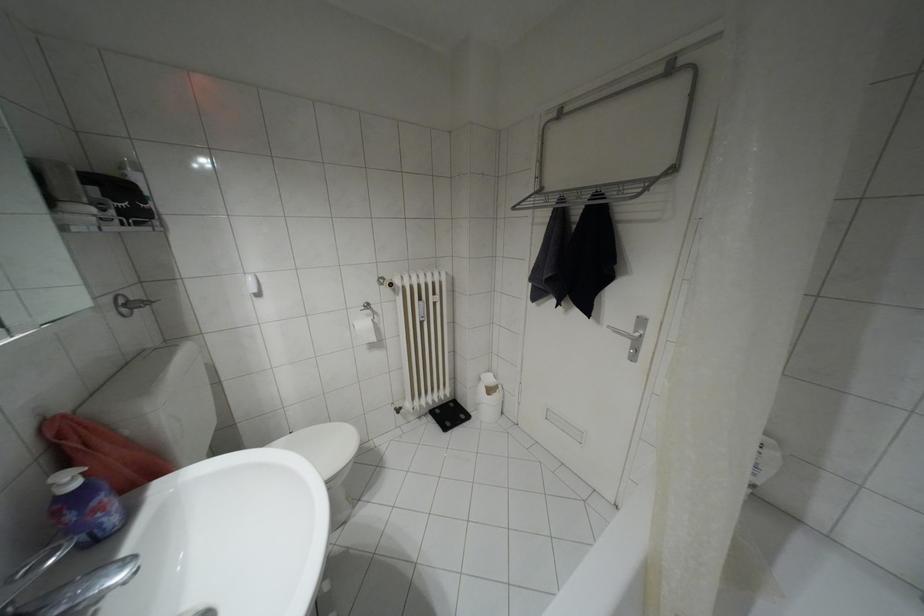
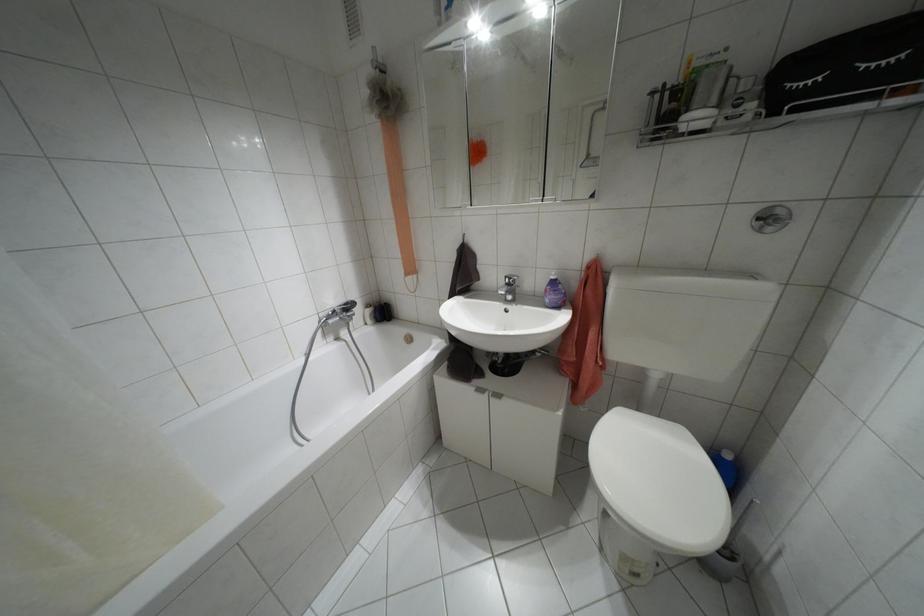
The point at [75,484] is marked in the first image. Where is the corresponding point in the second image?

(552, 277)